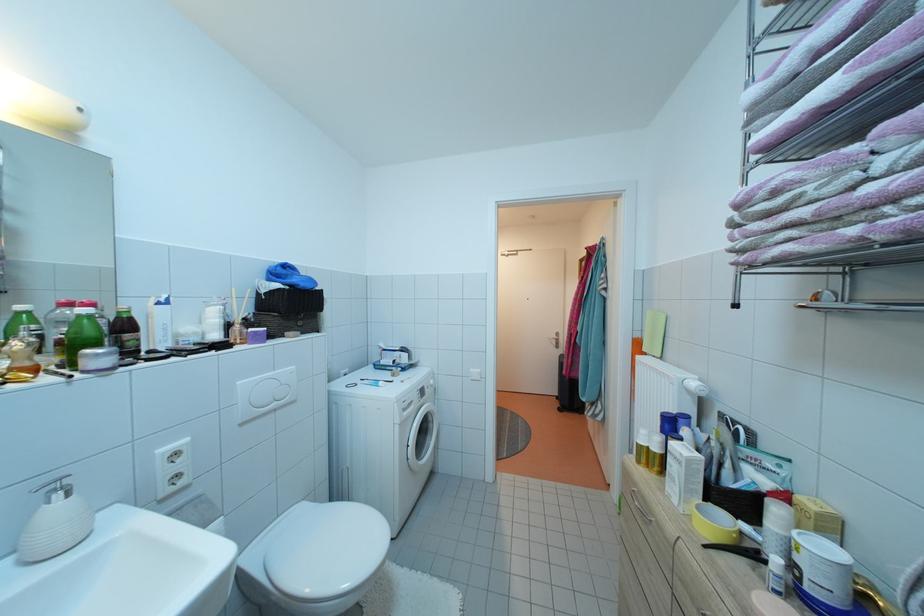
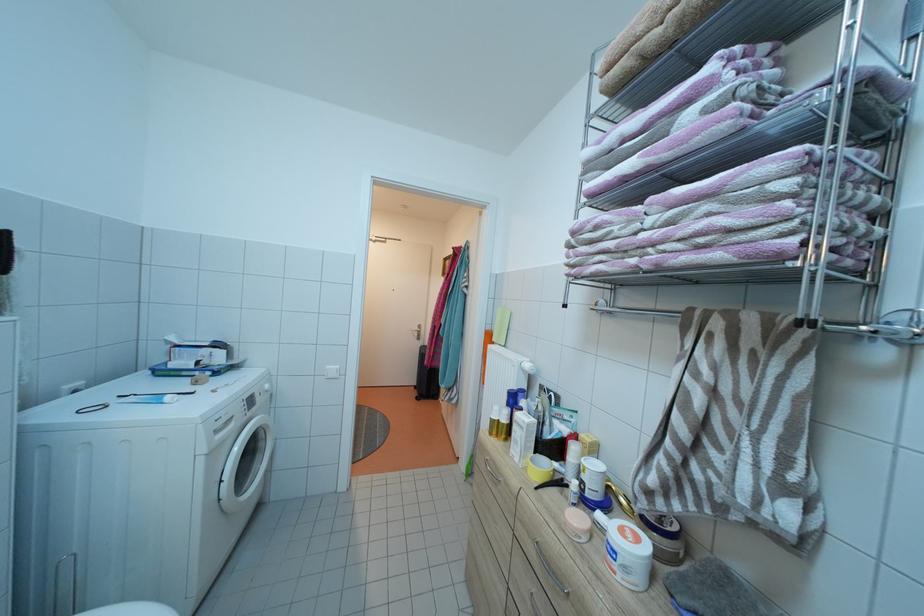
Question: The camera is either moving clockwise (left) or counter-clockwise (right) around the object. The first image is from the beginning of the video and the second image is from the end. Is the camera moving left or right when shooting the video?

Choices:
 (A) Left
 (B) Right

Answer: (A)